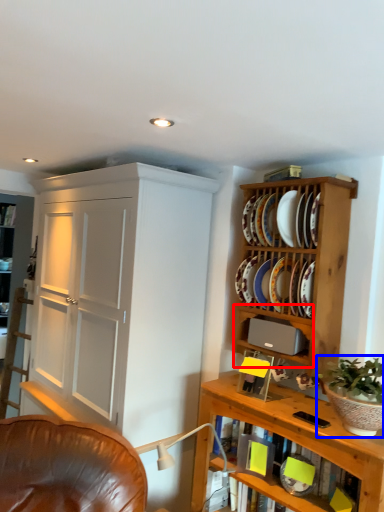
Question: Which of the following is the farthest to the observer, cabinet (highlighted by a red box) or houseplant (highlighted by a blue box)?

Choices:
 (A) cabinet
 (B) houseplant

Answer: (A)